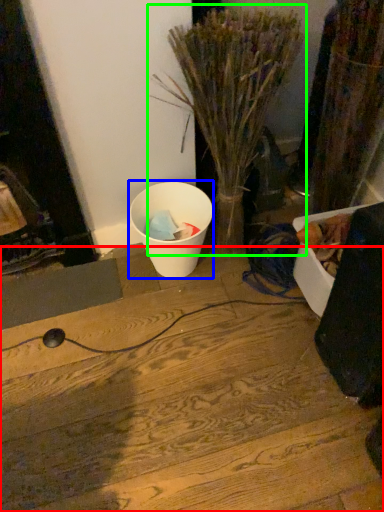
Question: Which is farther away from wood (highlighted by a red box)? waste (highlighted by a blue box) or houseplant (highlighted by a green box)?

Choices:
 (A) waste
 (B) houseplant

Answer: (B)